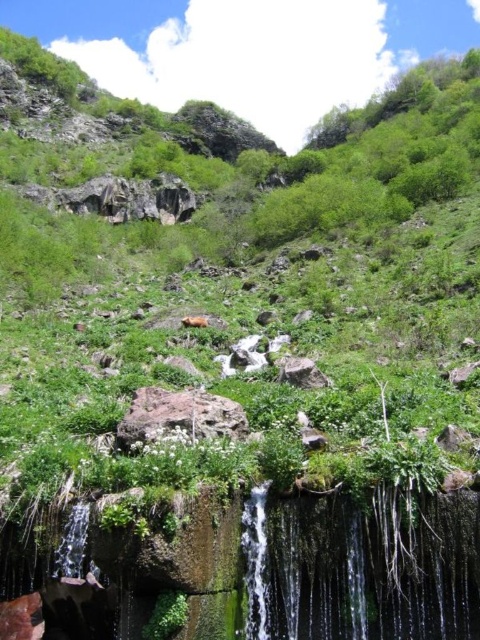
Which is in front, point (282, 621) or point (225, 422)?

Positioned in front is point (282, 621).

Can you confirm if clear water at center is positioned above rusty rock at center?

No, clear water at center is not above rusty rock at center.

What do you see at coordinates (358, 572) in the screenshot? Image resolution: width=480 pixels, height=640 pixels. I see `clear water at center` at bounding box center [358, 572].

The height and width of the screenshot is (640, 480). I want to click on clear water at center, so click(x=358, y=572).